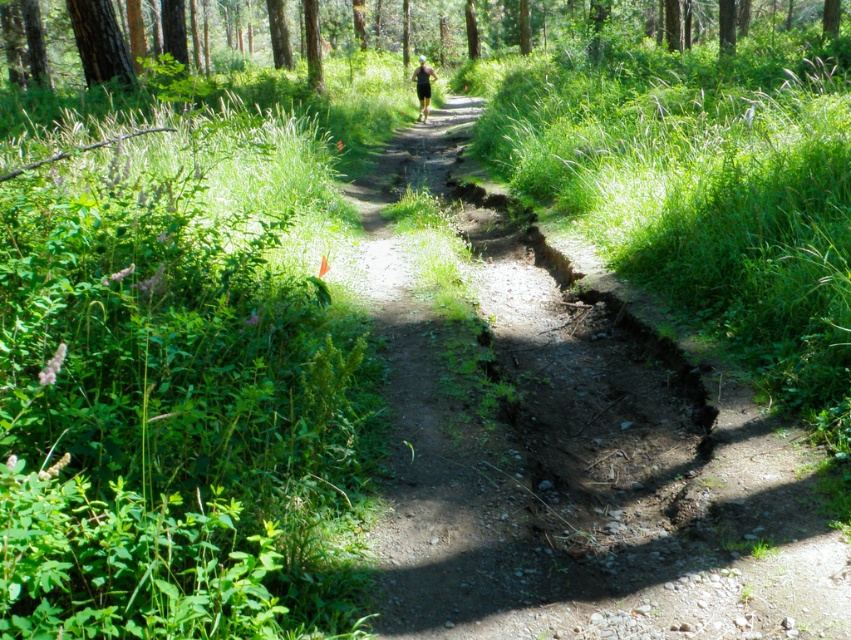
Who is more distant from viewer, [660,545] or [83,28]?

The point [83,28] is more distant.

Between dirt path at center and smooth brown tree trunk at upper left, which one has less height?

smooth brown tree trunk at upper left

What do you see at coordinates (572, 461) in the screenshot? I see `dirt path at center` at bounding box center [572, 461].

You are a GUI agent. You are given a task and a screenshot of the screen. Output one action in this format:
    pyautogui.click(x=<x>, y=<y>)
    Task: Click on the dirt path at center
    
    Given the screenshot: What is the action you would take?
    pyautogui.click(x=572, y=461)

Can you confirm if dirt path at center is taller than brown textured tree at upper center?

In fact, dirt path at center may be shorter than brown textured tree at upper center.

Consider the image. Who is taller, dirt path at center or brown textured tree at upper center?

Standing taller between the two is brown textured tree at upper center.

Which is in front, point (601, 522) or point (14, 29)?

Positioned in front is point (601, 522).

Where is `dirt path at center`? dirt path at center is located at coordinates (572, 461).

Which is more to the right, smooth brown tree trunk at upper left or black matte shorts at center?

black matte shorts at center

Which is in front, point (104, 80) or point (421, 97)?

Point (104, 80) is in front.

Locate an element on the screen. smooth brown tree trunk at upper left is located at coordinates (100, 42).